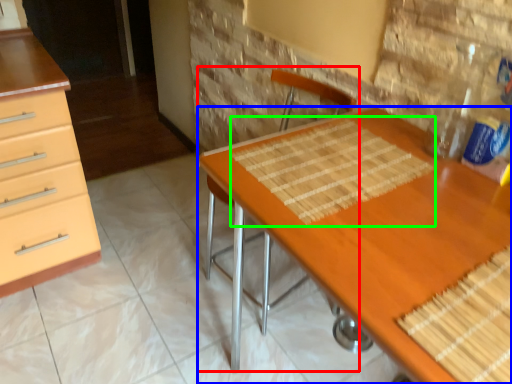
Question: Which object is the farthest from armchair (highlighted by a red box)? Choose among these: desk (highlighted by a blue box) or place mat (highlighted by a green box).

Choices:
 (A) desk
 (B) place mat

Answer: (A)